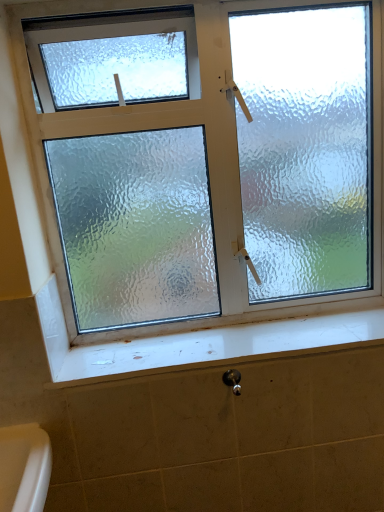
Question: Does satin nickel shower at lower center have a greater width compared to white glossy window sill at lower center?

Choices:
 (A) yes
 (B) no

Answer: (B)

Question: From a real-world perspective, is satin nickel shower at lower center below white glossy window sill at lower center?

Choices:
 (A) yes
 (B) no

Answer: (A)

Question: Is satin nickel shower at lower center thinner than white glossy window sill at lower center?

Choices:
 (A) yes
 (B) no

Answer: (A)

Question: Is satin nickel shower at lower center positioned before white glossy window sill at lower center?

Choices:
 (A) yes
 (B) no

Answer: (A)

Question: Is white glossy window sill at lower center a part of satin nickel shower at lower center?

Choices:
 (A) no
 (B) yes

Answer: (A)

Question: Is satin nickel shower at lower center not close to white glossy window sill at lower center?

Choices:
 (A) no
 (B) yes

Answer: (A)

Question: Is white glossy window sill at lower center located outside satin nickel shower at lower center?

Choices:
 (A) no
 (B) yes

Answer: (B)

Question: Does white glossy window sill at lower center lie in front of satin nickel shower at lower center?

Choices:
 (A) yes
 (B) no

Answer: (B)

Question: Does white glossy window sill at lower center have a smaller size compared to satin nickel shower at lower center?

Choices:
 (A) yes
 (B) no

Answer: (B)

Question: From a real-world perspective, is white glossy window sill at lower center physically below satin nickel shower at lower center?

Choices:
 (A) no
 (B) yes

Answer: (A)

Question: Can satin nickel shower at lower center be found inside white glossy window sill at lower center?

Choices:
 (A) yes
 (B) no

Answer: (B)

Question: Considering the relative sizes of white glossy window sill at lower center and satin nickel shower at lower center in the image provided, is white glossy window sill at lower center thinner than satin nickel shower at lower center?

Choices:
 (A) yes
 (B) no

Answer: (B)

Question: Is white glossy window sill at lower center wider or thinner than satin nickel shower at lower center?

Choices:
 (A) wide
 (B) thin

Answer: (A)